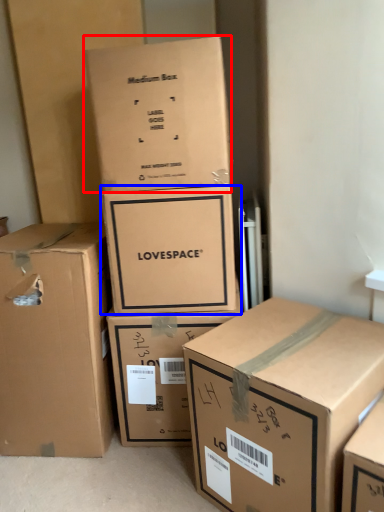
Question: Which object is further to the camera taking this photo, box (highlighted by a red box) or box (highlighted by a blue box)?

Choices:
 (A) box
 (B) box

Answer: (B)